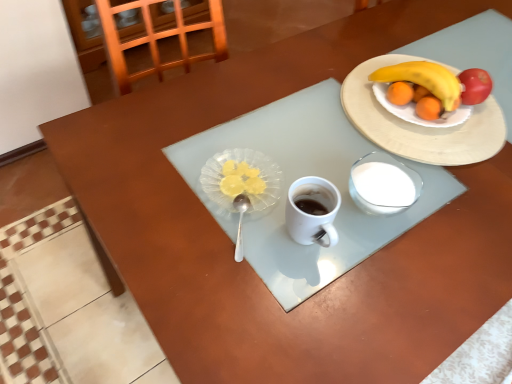
This screenshot has height=384, width=512. Identify the location of empty space that is in between white ceramic plate at upper right and translucent glass plate at center. (304, 144).